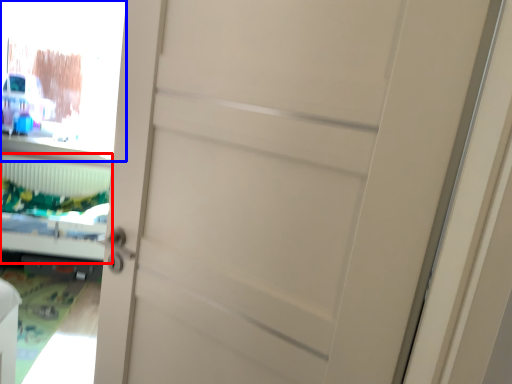
Question: Which object appears farthest to the camera in this image, bed (highlighted by a red box) or window screen (highlighted by a blue box)?

Choices:
 (A) bed
 (B) window screen

Answer: (B)